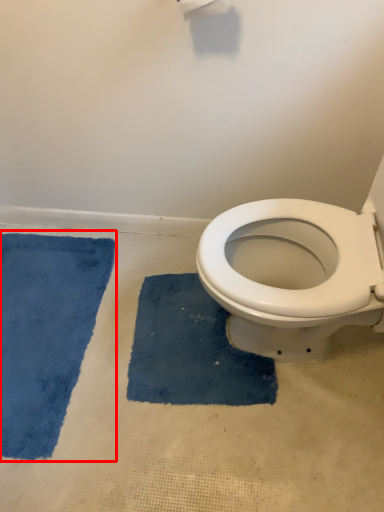
Question: From the image, what is the correct spatial relationship of bath mat (annotated by the red box) in relation to bath mat?

Choices:
 (A) left
 (B) right

Answer: (A)